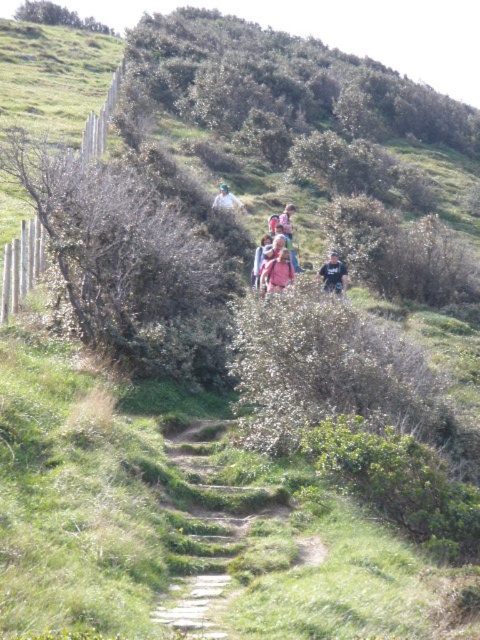
Question: Which of the following is the farthest from the observer?

Choices:
 (A) matte pink shirt at center
 (B) white fabric at center
 (C) green mossy stone steps at center
 (D) dark blue jacket at center

Answer: (B)

Question: Which of the following is the closest to the observer?

Choices:
 (A) (173, 595)
 (B) (333, 257)
 (C) (226, 196)

Answer: (A)

Question: Which of the following is the closest to the observer?

Choices:
 (A) (325, 275)
 (B) (182, 580)
 (C) (217, 205)
 (D) (292, 269)

Answer: (B)

Question: Is green mossy stone steps at center to the right of white fabric at center from the viewer's perspective?

Choices:
 (A) yes
 (B) no

Answer: (A)

Question: Can you confirm if green mossy stone steps at center is positioned above matte pink shirt at center?

Choices:
 (A) yes
 (B) no

Answer: (B)

Question: Can you confirm if green mossy stone steps at center is thinner than white fabric at center?

Choices:
 (A) no
 (B) yes

Answer: (A)